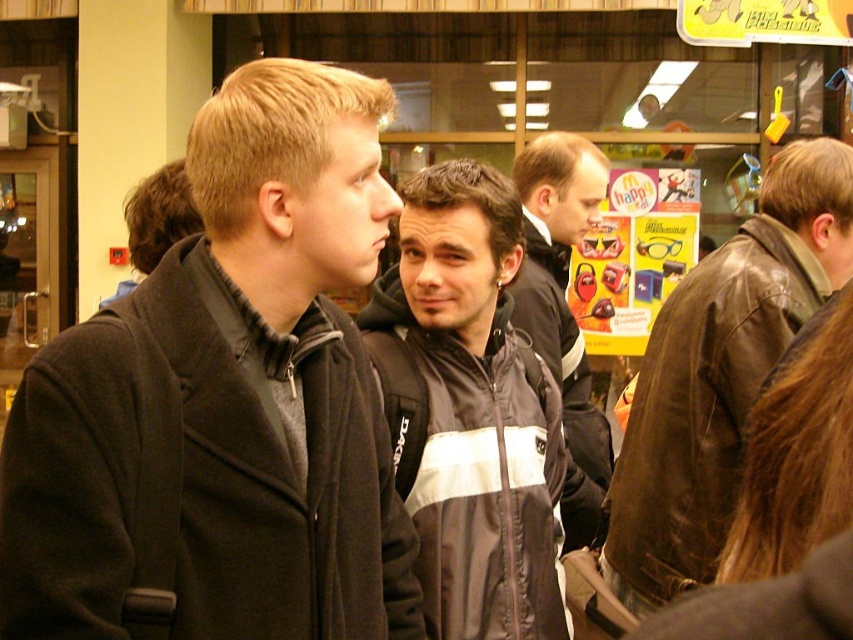
Question: Is the position of brown leather jacket at right more distant than that of dark gray jacket at center?

Choices:
 (A) no
 (B) yes

Answer: (A)

Question: Which object is the farthest from the brown leather jacket at right?

Choices:
 (A) black and white nylon jacket at center
 (B) dark gray woolen jacket at center
 (C) dark gray jacket at center

Answer: (B)

Question: Which point is closer to the camera?

Choices:
 (A) brown leather jacket at right
 (B) dark gray woolen jacket at center
 (C) black and white nylon jacket at center

Answer: (B)

Question: Which of the following is the closest to the observer?

Choices:
 (A) (695, 512)
 (B) (207, 419)
 (C) (577, 189)
 (D) (384, 392)

Answer: (B)

Question: Observing the image, what is the correct spatial positioning of dark gray woolen jacket at center in reference to brown leather jacket at right?

Choices:
 (A) left
 (B) right

Answer: (A)

Question: Is dark gray woolen jacket at center thinner than black and white nylon jacket at center?

Choices:
 (A) no
 (B) yes

Answer: (A)